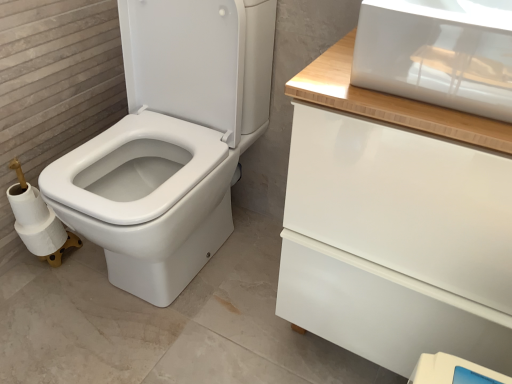
Measure the distance between white matte toilet paper at lower left and camera.

The distance of white matte toilet paper at lower left from camera is 3.75 feet.

This screenshot has height=384, width=512. What do you see at coordinates (35, 221) in the screenshot?
I see `white matte toilet paper at lower left` at bounding box center [35, 221].

Image resolution: width=512 pixels, height=384 pixels. What are the coordinates of `white matte toilet paper at lower left` in the screenshot? It's located at (35, 221).

This screenshot has height=384, width=512. What do you see at coordinates (403, 202) in the screenshot?
I see `white glossy drawer at upper right` at bounding box center [403, 202].

What are the coordinates of `white glossy drawer at upper right` in the screenshot? It's located at (403, 202).

Find the location of a particular element. This screenshot has width=512, height=384. white matte toilet paper at lower left is located at coordinates (35, 221).

Considering the relative positions of white glossy drawer at upper right and white matte toilet paper at lower left in the image provided, is white glossy drawer at upper right to the left of white matte toilet paper at lower left from the viewer's perspective?

In fact, white glossy drawer at upper right is to the right of white matte toilet paper at lower left.

Which object is closer to the camera, white glossy drawer at upper right or white matte toilet paper at lower left?

Positioned in front is white glossy drawer at upper right.

Considering the points (461, 205) and (61, 225), which point is behind, point (461, 205) or point (61, 225)?

Positioned behind is point (61, 225).

From the image's perspective, is white glossy drawer at upper right over white matte toilet paper at lower left?

→ Correct, white glossy drawer at upper right appears higher than white matte toilet paper at lower left in the image.

From a real-world perspective, does white glossy drawer at upper right sit lower than white matte toilet paper at lower left?

No, from a real-world perspective, white glossy drawer at upper right is not under white matte toilet paper at lower left.

Which of these two, white glossy drawer at upper right or white matte toilet paper at lower left, is wider?

Wider between the two is white glossy drawer at upper right.

Considering the relative sizes of white glossy drawer at upper right and white matte toilet paper at lower left in the image provided, is white glossy drawer at upper right taller than white matte toilet paper at lower left?

Yes.

Who is bigger, white glossy drawer at upper right or white matte toilet paper at lower left?

Bigger between the two is white glossy drawer at upper right.

Looking at this image, is white glossy drawer at upper right located outside white matte toilet paper at lower left?

white glossy drawer at upper right is positioned outside white matte toilet paper at lower left.

Is white glossy drawer at upper right far from white matte toilet paper at lower left?

No, white glossy drawer at upper right is in close proximity to white matte toilet paper at lower left.

Is white glossy drawer at upper right turned away from white matte toilet paper at lower left?

white glossy drawer at upper right is not turned away from white matte toilet paper at lower left.

Identify the location of toilet paper on the left of white glossy drawer at upper right. (35, 221).

Is white matte toilet paper at lower left to the right of white glossy drawer at upper right from the viewer's perspective?

In fact, white matte toilet paper at lower left is to the left of white glossy drawer at upper right.

Which object is further away from the camera taking this photo, white matte toilet paper at lower left or white glossy drawer at upper right?

white matte toilet paper at lower left is further from the camera.

Which is closer to the camera, (10, 200) or (371, 146)?

Point (10, 200) is farther from the camera than point (371, 146).

From the image's perspective, which is above, white matte toilet paper at lower left or white glossy drawer at upper right?

white glossy drawer at upper right appears higher in the image.

From a real-world perspective, is white matte toilet paper at lower left on top of white glossy drawer at upper right?

No, from a real-world perspective, white matte toilet paper at lower left is not over white glossy drawer at upper right

Which object is thinner, white matte toilet paper at lower left or white glossy drawer at upper right?

Thinner between the two is white matte toilet paper at lower left.

Is white matte toilet paper at lower left taller or shorter than white glossy drawer at upper right?

Considering their sizes, white matte toilet paper at lower left has less height than white glossy drawer at upper right.

Which of these two, white matte toilet paper at lower left or white glossy drawer at upper right, is bigger?

Bigger between the two is white glossy drawer at upper right.

From the picture: Which is correct: white matte toilet paper at lower left is inside white glossy drawer at upper right, or outside of it?

white matte toilet paper at lower left cannot be found inside white glossy drawer at upper right.

Are white matte toilet paper at lower left and white glossy drawer at upper right making contact?

white matte toilet paper at lower left and white glossy drawer at upper right are clearly separated.

Is white matte toilet paper at lower left positioned with its back to white glossy drawer at upper right?

white matte toilet paper at lower left does not have its back to white glossy drawer at upper right.

How distant is white matte toilet paper at lower left from white glossy drawer at upper right?

A distance of 91.30 centimeters exists between white matte toilet paper at lower left and white glossy drawer at upper right.

Where is `toilet paper behind the white glossy drawer at upper right`? toilet paper behind the white glossy drawer at upper right is located at coordinates (35, 221).

At what (x,y) coordinates should I click in order to perform the action: click on drawer in front of the white matte toilet paper at lower left. Please return your answer as a coordinate pair (x, y). The width and height of the screenshot is (512, 384). Looking at the image, I should click on (403, 202).

Identify the location of toilet paper below the white glossy drawer at upper right (from a real-world perspective). This screenshot has height=384, width=512. (35, 221).